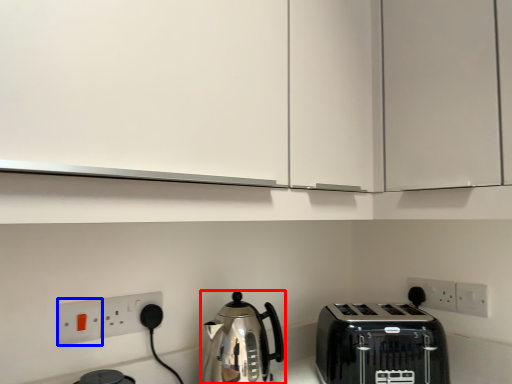
Question: Which point is closer to the camera, kettle (highlighted by a red box) or electric outlet (highlighted by a blue box)?

Choices:
 (A) kettle
 (B) electric outlet

Answer: (A)